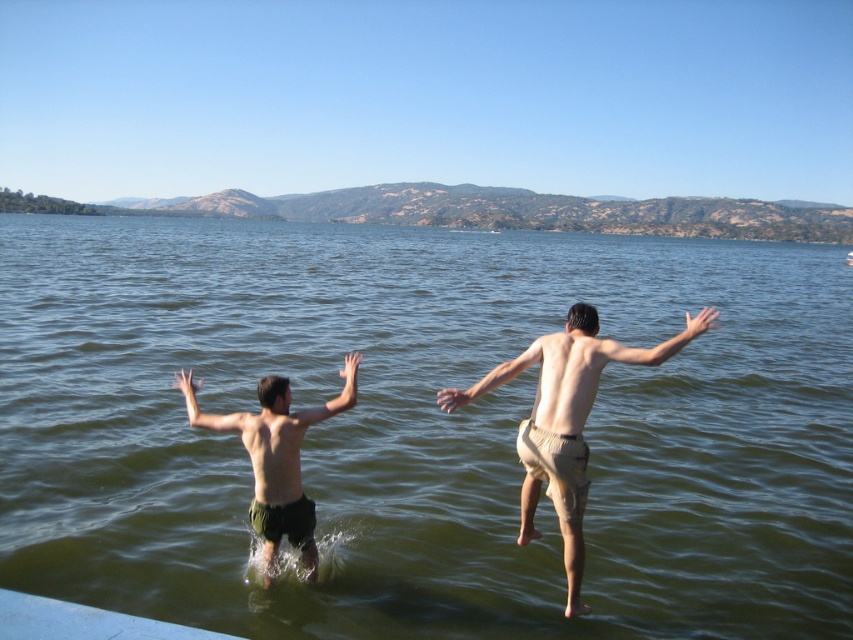
Can you confirm if green water at center is wider than dark green shorts at left?

Indeed, green water at center has a greater width compared to dark green shorts at left.

Does green water at center appear on the left side of dark green shorts at left?

No, green water at center is not to the left of dark green shorts at left.

At what (x,y) coordinates should I click in order to perform the action: click on green water at center. Please return your answer as a coordinate pair (x, y). Looking at the image, I should click on (422, 428).

Find the location of a particular element. Image resolution: width=853 pixels, height=640 pixels. green water at center is located at coordinates (422, 428).

What do you see at coordinates (566, 420) in the screenshot? The height and width of the screenshot is (640, 853). I see `tan fabric shorts at center` at bounding box center [566, 420].

Does tan fabric shorts at center have a lesser width compared to dark green shorts at left?

In fact, tan fabric shorts at center might be wider than dark green shorts at left.

Measure the distance between tan fabric shorts at center and camera.

The distance of tan fabric shorts at center from camera is 5.14 meters.

Find the location of a particular element. tan fabric shorts at center is located at coordinates (566, 420).

Locate an element on the screen. The height and width of the screenshot is (640, 853). green water at center is located at coordinates (422, 428).

The width and height of the screenshot is (853, 640). What do you see at coordinates (422, 428) in the screenshot? I see `green water at center` at bounding box center [422, 428].

Identify the location of green water at center. (422, 428).